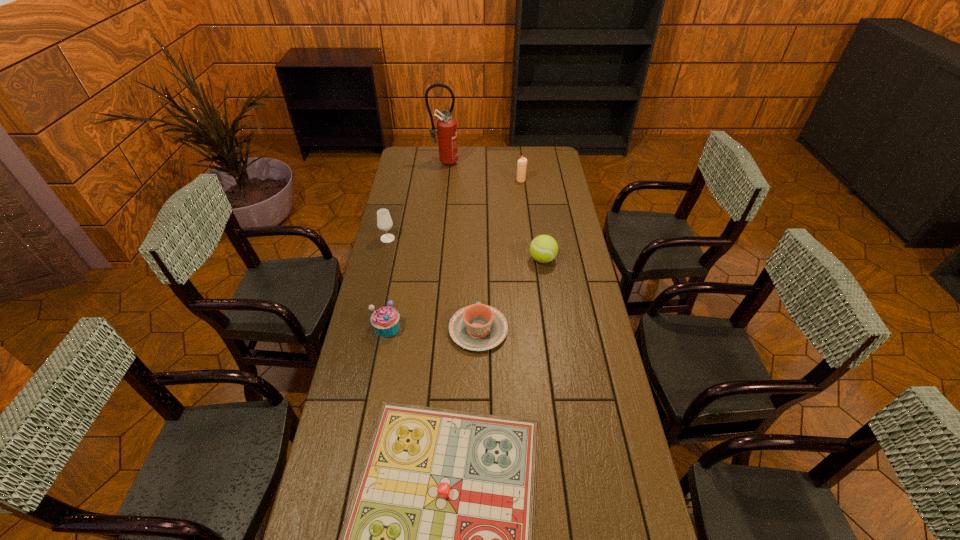
Identify the location of object that is at the far left corner. (446, 125).

Where is `free region at the far edge`? The image size is (960, 540). free region at the far edge is located at coordinates (499, 152).

Where is `vacant region at the left edge of the desktop`? The image size is (960, 540). vacant region at the left edge of the desktop is located at coordinates click(386, 246).

What are the coordinates of `free point at the right edge` in the screenshot? It's located at (563, 172).

Identify the location of vacant area at the far right corner. Image resolution: width=960 pixels, height=540 pixels. (531, 147).

Identify the location of vacant point located between the sixth nearest object and the sixth tallest object. The image size is (960, 540). (499, 255).

This screenshot has width=960, height=540. What are the coordinates of `blank region between the fifth nearest object and the chinaware` in the screenshot? It's located at (433, 284).

The image size is (960, 540). Find the location of `free spot between the fire extinguisher and the sixth nearest object`. free spot between the fire extinguisher and the sixth nearest object is located at coordinates (483, 171).

You are a GUI agent. You are given a task and a screenshot of the screen. Output one action in this format:
    pyautogui.click(x=<x>, y=<y>)
    Task: Click on the empty space between the third farthest object and the second farthest object
    
    Given the screenshot: What is the action you would take?
    pyautogui.click(x=454, y=210)

Identify the location of free spot between the muffin and the sixth tallest object. (433, 328).